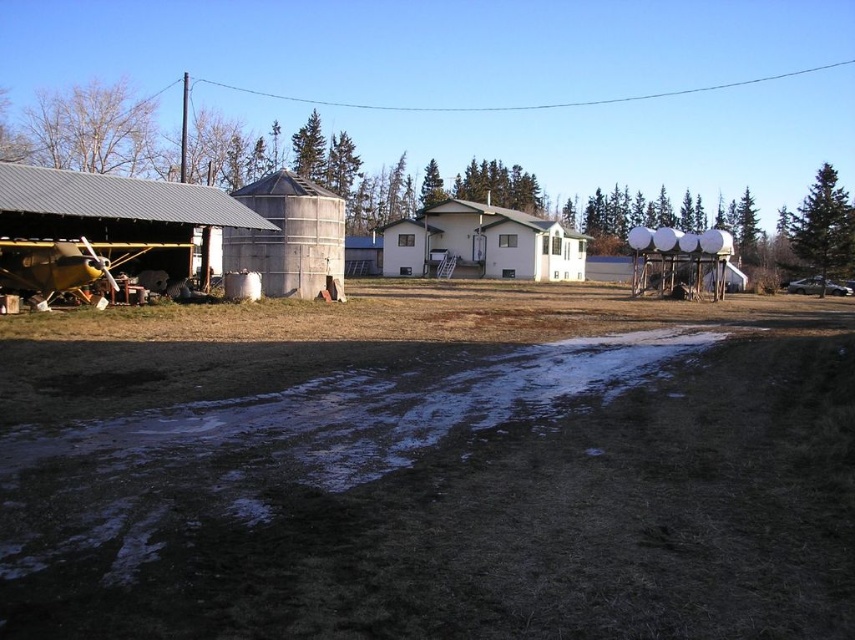
Describe the element at coordinates (429, 468) in the screenshot. This screenshot has height=640, width=855. I see `brown grass at lower center` at that location.

Can you confirm if brown grass at lower center is positioned to the right of brown grassy field at lower center?

No, brown grass at lower center is not to the right of brown grassy field at lower center.

Between point (86, 320) and point (741, 317), which one is positioned behind?

The point (741, 317) is behind.

What are the coordinates of `brown grass at lower center` in the screenshot? It's located at (429, 468).

Looking at this image, is brown grassy field at lower center further to the viewer compared to brushed metal barn at left?

No, brown grassy field at lower center is closer to the viewer.

Between point (513, 288) and point (175, 241), which one is positioned behind?

Point (513, 288)

Identify the location of brown grassy field at lower center. (431, 316).

Who is higher up, brown grassy field at lower center or white matte house at center?

white matte house at center

Is the position of brown grassy field at lower center more distant than that of white matte house at center?

That is False.

You are a GUI agent. You are given a task and a screenshot of the screen. Output one action in this format:
    pyautogui.click(x=<x>, y=<y>)
    Task: Click on the brown grassy field at lower center
    The width and height of the screenshot is (855, 640).
    Given the screenshot: What is the action you would take?
    pyautogui.click(x=431, y=316)